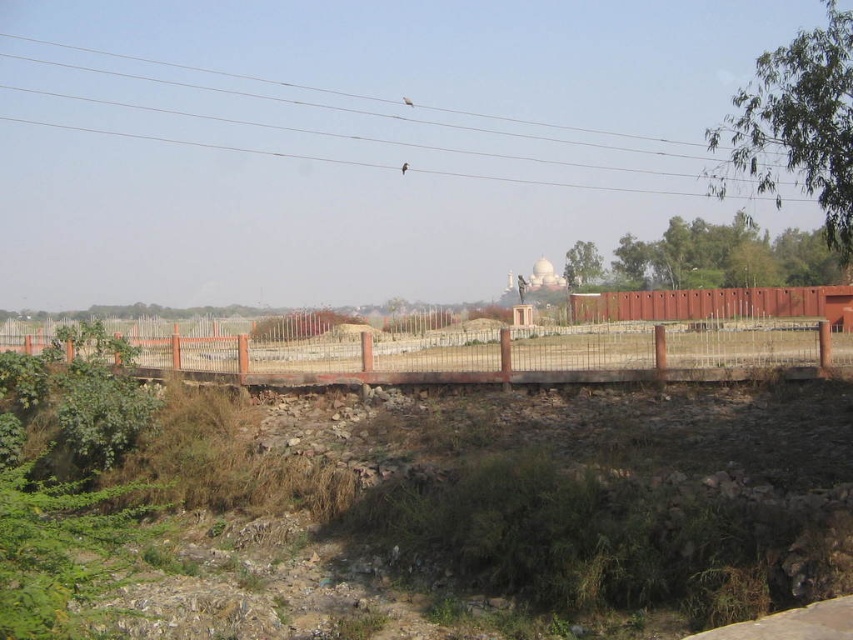
Question: Does orange metal fence at center come behind smooth wire at upper center?

Choices:
 (A) no
 (B) yes

Answer: (B)

Question: Observing the image, what is the correct spatial positioning of orange metal fence at center in reference to smooth wire at upper center?

Choices:
 (A) below
 (B) above

Answer: (A)

Question: Which object appears closest to the camera in this image?

Choices:
 (A) smooth wire at upper center
 (B) orange metal fence at center

Answer: (A)

Question: Which point is farther to the camera?

Choices:
 (A) (192, 356)
 (B) (396, 145)
 (C) (767, 300)

Answer: (B)

Question: Among these objects, which one is nearest to the camera?

Choices:
 (A) smooth wire at upper center
 (B) orange metal fence at center

Answer: (A)

Question: Is orange metal fence at center thinner than smooth wire at upper center?

Choices:
 (A) no
 (B) yes

Answer: (B)